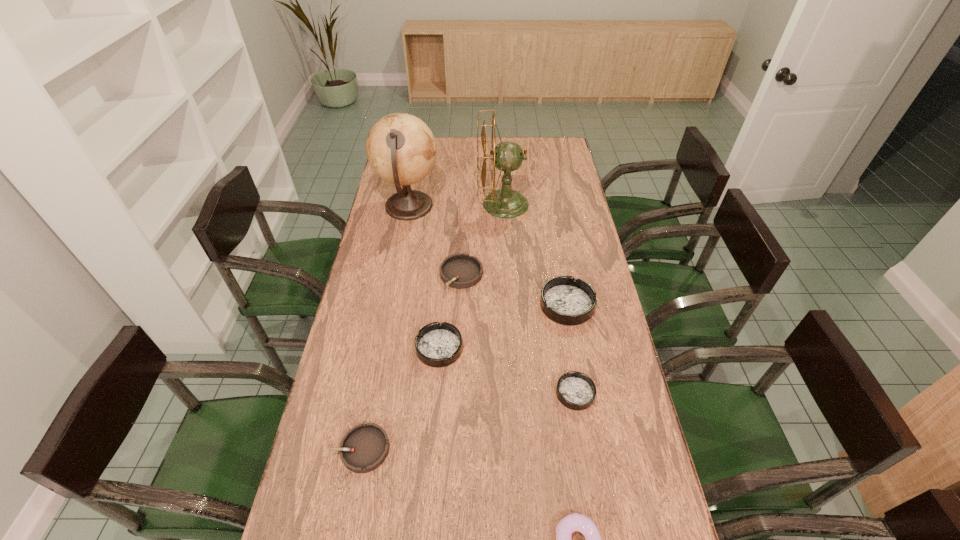
The image size is (960, 540). What are the coordinates of `fan` in the screenshot? It's located at (508, 156).

At what (x,y) coordinates should I click in order to perform the action: click on globe. Please return your answer as a coordinate pair (x, y). This screenshot has height=540, width=960. Looking at the image, I should click on (401, 149).

I want to click on the farthest dark ashtray, so click(x=567, y=301).

The height and width of the screenshot is (540, 960). Identify the location of the bigger gray ashtray. (460, 271).

Image resolution: width=960 pixels, height=540 pixels. Identify the location of the farther gray ashtray. (460, 271).

The width and height of the screenshot is (960, 540). What are the coordinates of `the leftmost dark ashtray` in the screenshot? It's located at (437, 344).

Find the location of a particular element. Image resolution: width=960 pixels, height=540 pixels. the third farthest ashtray is located at coordinates (437, 344).

Locate an element on the screen. This screenshot has height=540, width=960. the smaller gray ashtray is located at coordinates (364, 448).

Find the location of a particular element. This screenshot has height=540, width=960. the seventh farthest object is located at coordinates (364, 448).

You are a GUI agent. You are given a task and a screenshot of the screen. Output one action in this format:
    pyautogui.click(x=<x>, y=<y>)
    Task: Click on the third nearest object
    The image size is (960, 540).
    Given the screenshot: What is the action you would take?
    pyautogui.click(x=575, y=390)